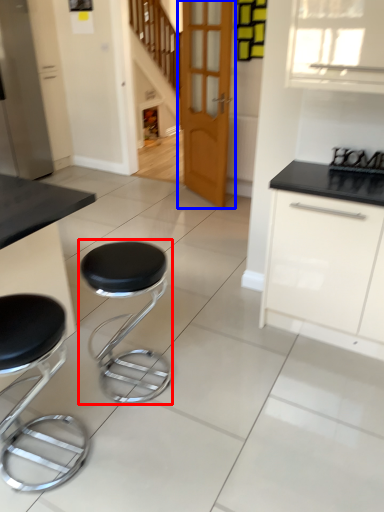
Question: Which of the following is the closest to the observer, stool (highlighted by a red box) or door (highlighted by a blue box)?

Choices:
 (A) stool
 (B) door

Answer: (A)